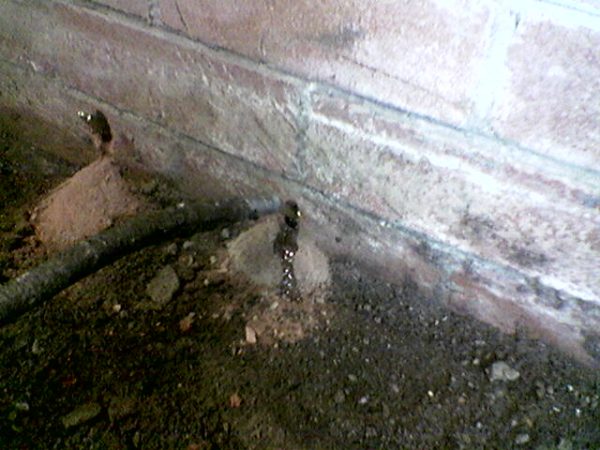
The height and width of the screenshot is (450, 600). In order to click on floor in this screenshot , I will do `click(307, 402)`.